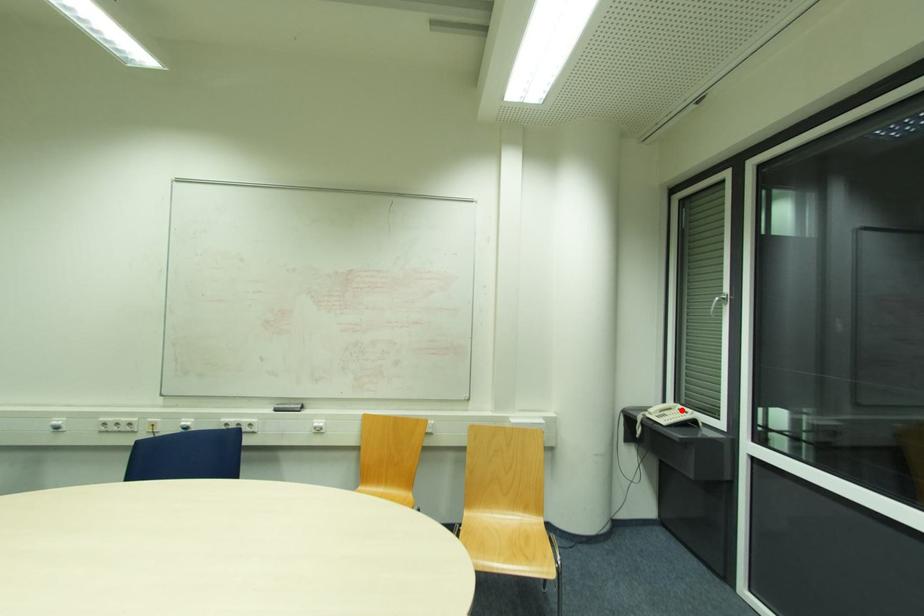
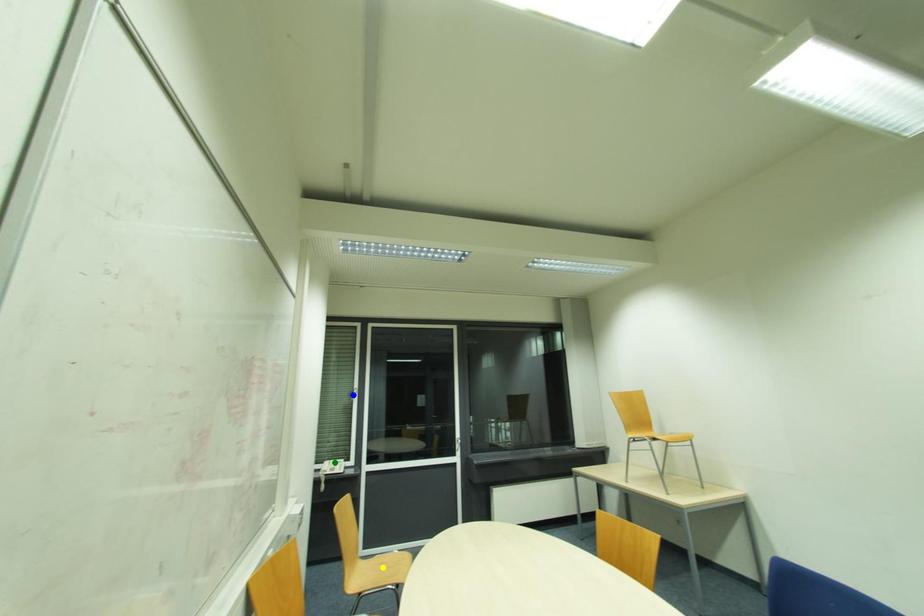
Question: I am providing you with two images of the same scene from different viewpoints. A red point is marked on the first image. You are given multiple points on the second image. Which spot in image 2 lines up with the point in image 1?

Choices:
 (A) yellow point
 (B) green point
 (C) blue point

Answer: (B)